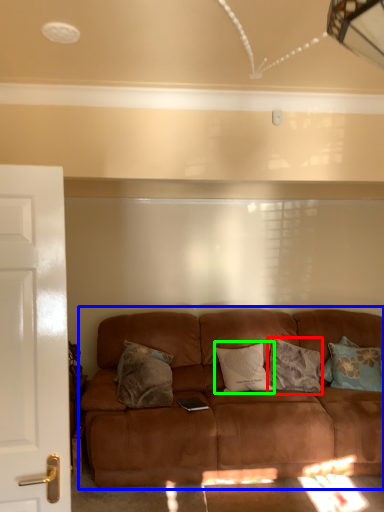
Question: Considering the real-world distances, which object is farthest from pillow (highlighted by a red box)? studio couch (highlighted by a blue box) or pillow (highlighted by a green box)?

Choices:
 (A) studio couch
 (B) pillow

Answer: (A)